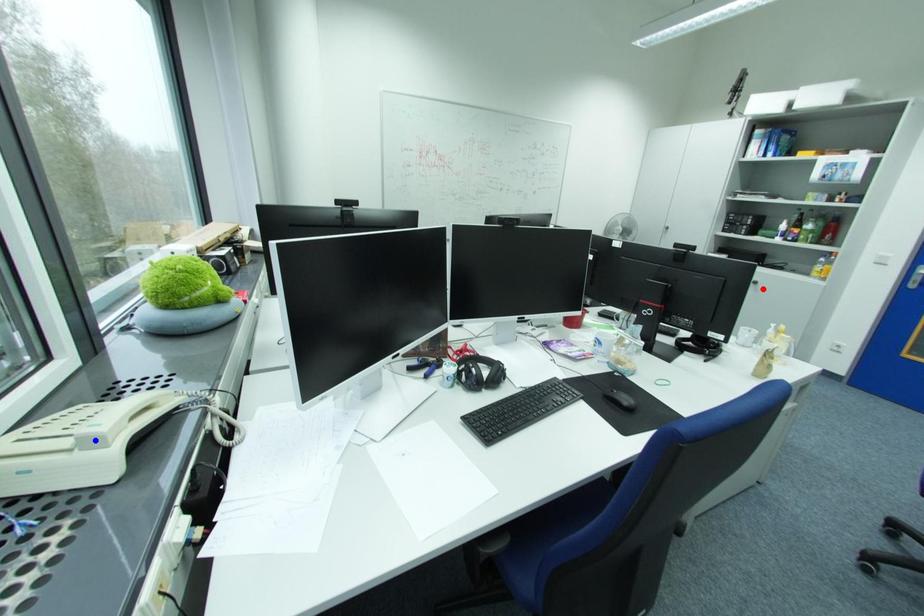
Question: Which of the two points in the image is closer to the camera?

Choices:
 (A) Blue point is closer.
 (B) Red point is closer.

Answer: (A)